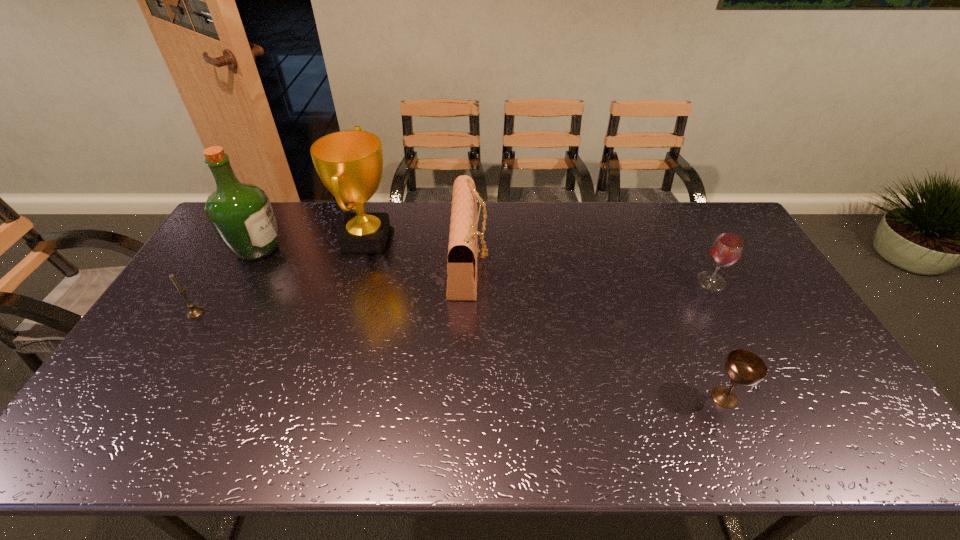
This screenshot has height=540, width=960. In order to click on free space between the nearest object and the wineglass in this screenshot , I will do `click(718, 339)`.

Where is `free space between the nearest object and the candle`? This screenshot has width=960, height=540. free space between the nearest object and the candle is located at coordinates (460, 355).

You are a GUI agent. You are given a task and a screenshot of the screen. Output one action in this format:
    pyautogui.click(x=<x>, y=<y>)
    Task: Click on the free spot between the award and the nearest object
    Image resolution: width=960 pixels, height=540 pixels.
    Given the screenshot: What is the action you would take?
    pyautogui.click(x=546, y=320)

This screenshot has height=540, width=960. I want to click on free space between the fourth shortest object and the candle, so click(332, 287).

Identify which object is located as the second nearest to the rightmost object. Please provide its 2D coordinates. Your answer should be formatted as a tuple, i.e. [(x, y)], where the tuple contains the x and y coordinates of a point satisfying the conditions above.

[(462, 249)]

At what (x,y) coordinates should I click in order to perform the action: click on object that is the closest to the nearest object. Please return your answer as a coordinate pair (x, y). Looking at the image, I should click on (726, 250).

At what (x,y) coordinates should I click in order to perform the action: click on free location that satisfies the following two spatial constraints: 1. on the front-facing side of the fourth object from right to left; 2. on the back side of the rightmost object. Please return your answer as a coordinate pair (x, y). The width and height of the screenshot is (960, 540). Looking at the image, I should click on (356, 281).

Where is `free space that satisfies the following two spatial constraints: 1. on the back side of the nearest object; 2. on the front-facing side of the third tallest object`? This screenshot has height=540, width=960. free space that satisfies the following two spatial constraints: 1. on the back side of the nearest object; 2. on the front-facing side of the third tallest object is located at coordinates (664, 262).

Locate an element on the screen. This screenshot has width=960, height=540. vacant space that satisfies the following two spatial constraints: 1. on the front-facing side of the fourth shortest object; 2. on the back side of the rightmost object is located at coordinates (468, 281).

At what (x,y) coordinates should I click in order to perform the action: click on vacant space that satisfies the following two spatial constraints: 1. on the front-facing side of the third tallest object; 2. on the back side of the second object from right to left. Please return your answer as a coordinate pair (x, y). The width and height of the screenshot is (960, 540). Looking at the image, I should click on (465, 397).